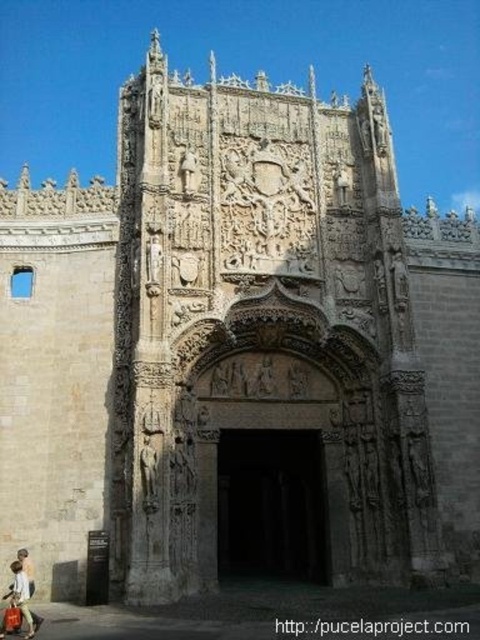
You are an architect analyzing the facade of this historic building. You notice the dark stone archway at center and the matte beige coat at lower left. Which object is taller?

The dark stone archway at center is taller than the matte beige coat at lower left.

You are an architect examining the historic building. You notice a point at coordinates (272,506) on the facade. What architectural element is located at this specific point?

The dark stone archway at center is located at point (272,506).